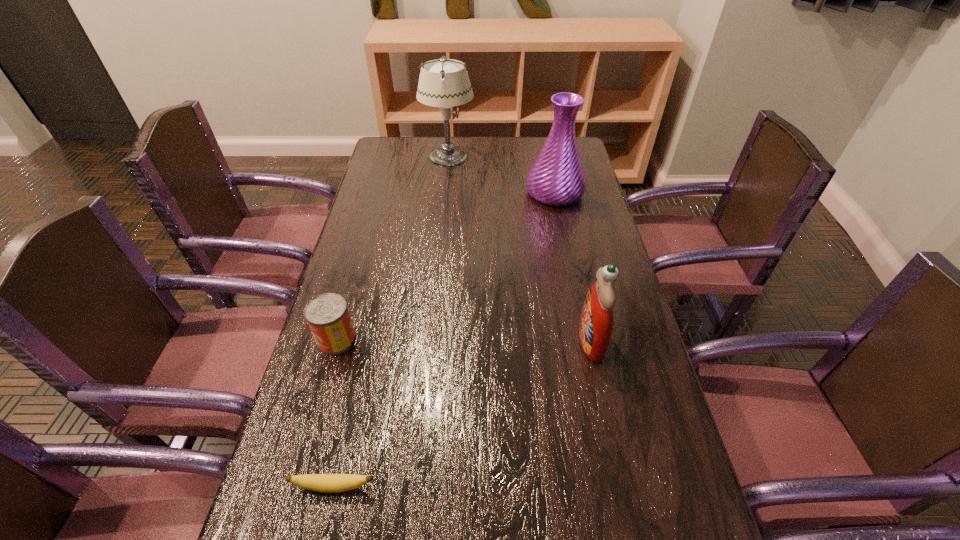
This screenshot has width=960, height=540. Identify the location of blank space located 0.400m on the front surface of the fourth shortest object. (420, 340).

Image resolution: width=960 pixels, height=540 pixels. I want to click on free space located 0.380m on the back of the fourth tallest object, so click(x=368, y=232).

Where is `free space located on the right of the fifth tallest object`? free space located on the right of the fifth tallest object is located at coordinates (549, 487).

Where is `object that is at the far edge`? The image size is (960, 540). object that is at the far edge is located at coordinates (444, 83).

Where is `can that is at the left edge`? The width and height of the screenshot is (960, 540). can that is at the left edge is located at coordinates (327, 314).

The image size is (960, 540). Identify the location of banana at the left edge. (330, 483).

Locate an element on the screen. The width and height of the screenshot is (960, 540). vase that is at the right edge is located at coordinates (557, 178).

Locate an element on the screen. The width and height of the screenshot is (960, 540). detergent located at the right edge is located at coordinates (596, 321).

The image size is (960, 540). In the image, there is a desktop. In order to click on vacant area at the far edge in this screenshot , I will do `click(452, 142)`.

In the image, there is a desktop. Identify the location of vacant space at the left edge. (388, 221).